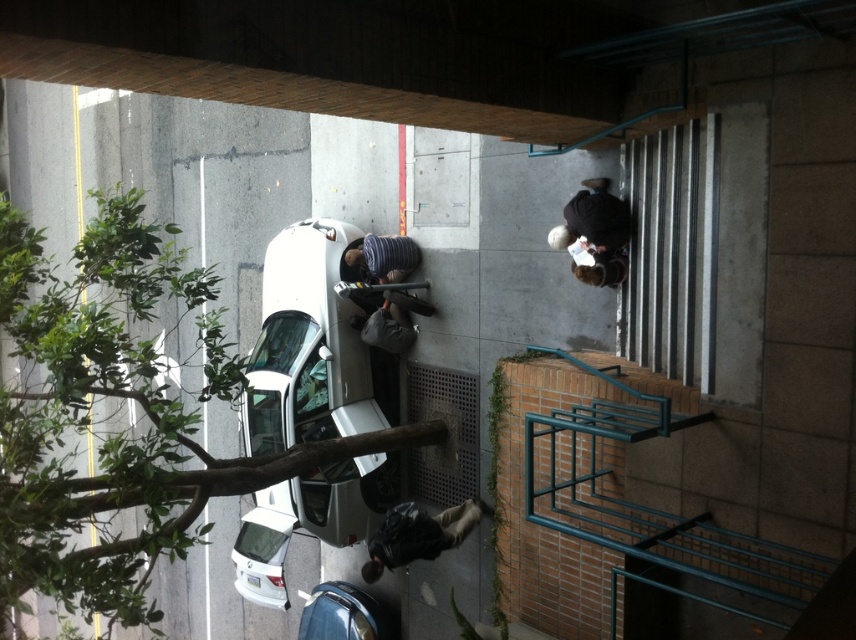
Question: Can you confirm if green leafy tree at lower left is positioned below brown fuzzy coat at upper right?

Choices:
 (A) yes
 (B) no

Answer: (A)

Question: Which of the following is the farthest from the observer?

Choices:
 (A) (179, 554)
 (B) (587, 211)
 (C) (346, 467)

Answer: (C)

Question: Does black matte jacket at lower center appear on the left side of white matte car at lower left?

Choices:
 (A) yes
 (B) no

Answer: (B)

Question: Which point is farther from the camera taking this photo?

Choices:
 (A) (849, 32)
 (B) (357, 317)
 (C) (325, 584)

Answer: (C)

Question: Estimate the real-world distances between objects in this image. Which object is farther from the white matte car at lower left?

Choices:
 (A) metallic blue car at lower center
 (B) brown fuzzy coat at upper right
 (C) dark gray fabric jacket at center
 (D) brick overpass at upper center

Answer: (D)

Question: Is teal metal stairwell at upper right smaller than brown fuzzy coat at upper right?

Choices:
 (A) no
 (B) yes

Answer: (A)